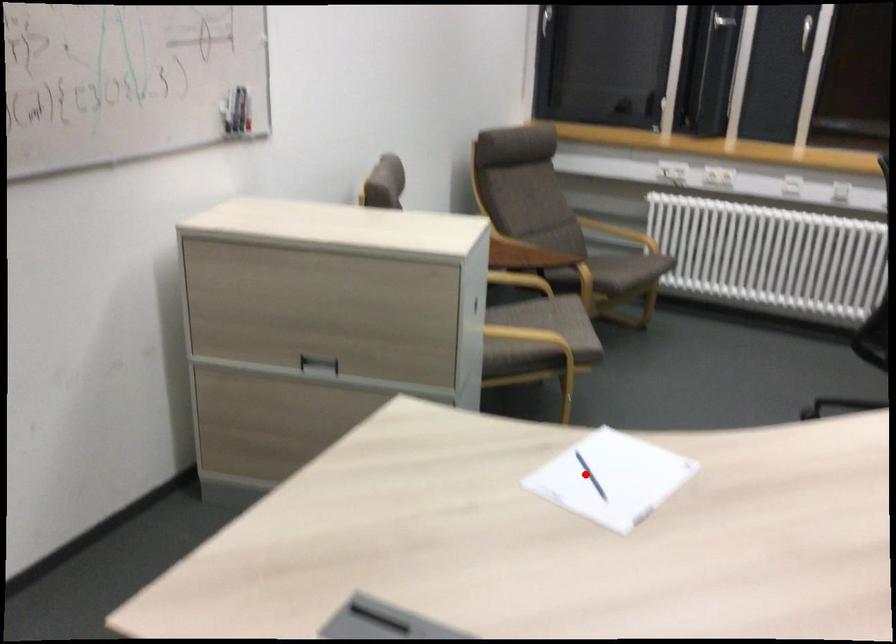
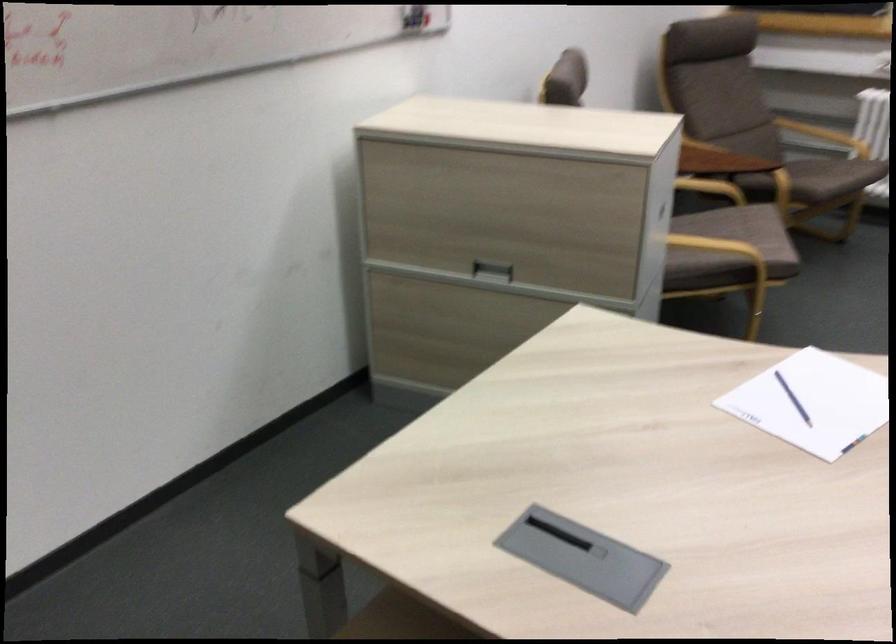
Question: I am providing you with two images of the same scene from different viewpoints. Image1 has a red point marked. In image2, the corresponding 3D location appears at what relative position? Reply with the corresponding letter.

Choices:
 (A) Closer
 (B) Farther

Answer: (A)